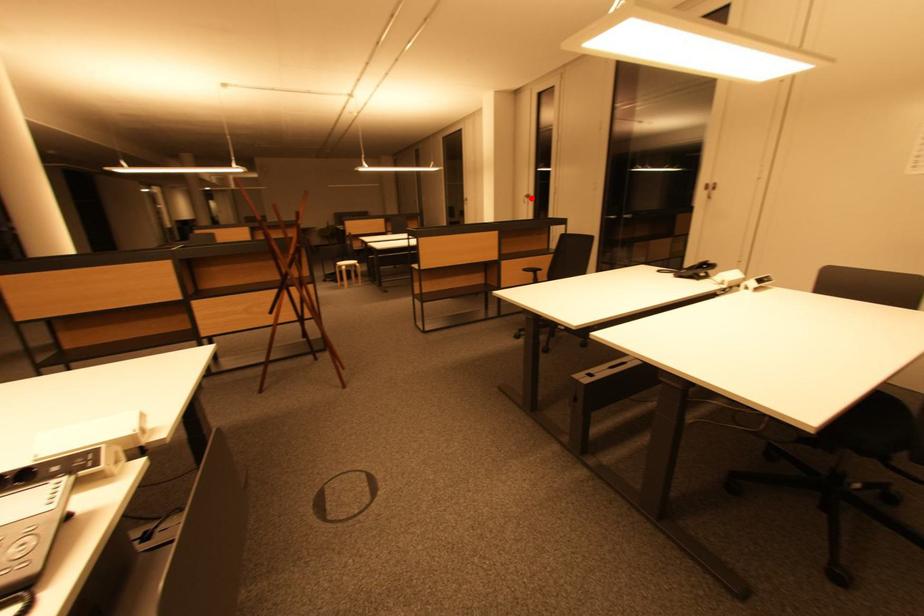
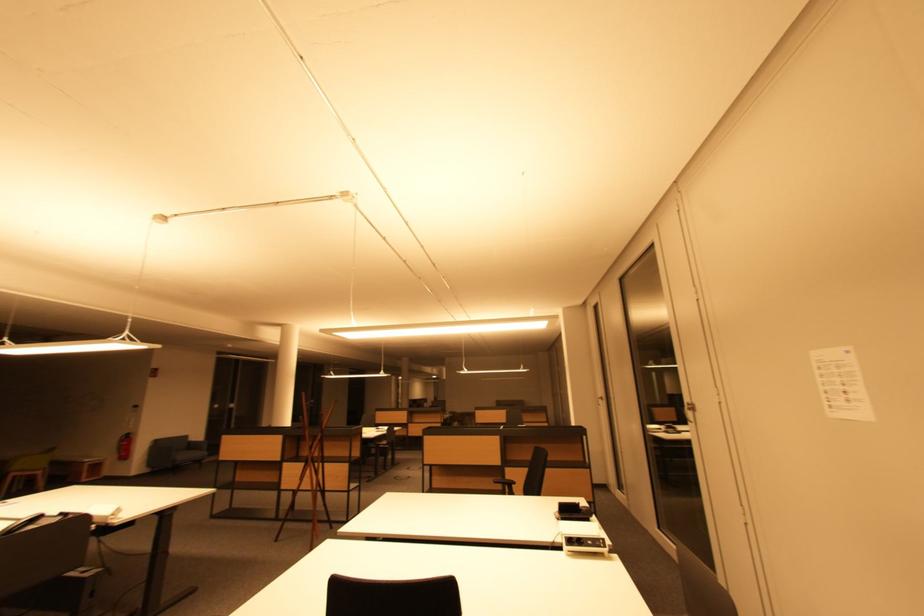
Question: I am providing you with two images of the same scene from different viewpoints. Image1 has a red point marked. In image2, the corresponding 3D location appears at what relative position? Reply with the corresponding letter.

Choices:
 (A) Closer
 (B) Farther

Answer: (B)